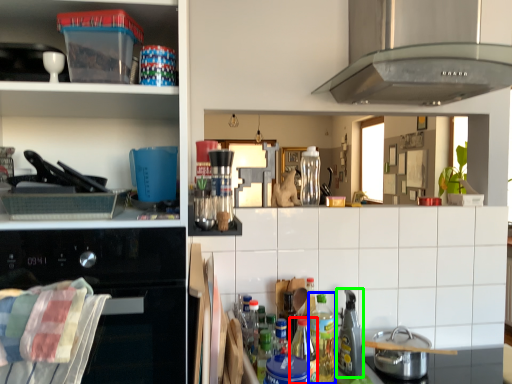
Question: Which is farther away from bottle (highlighted by a red box)? bottle (highlighted by a blue box) or appliance (highlighted by a green box)?

Choices:
 (A) bottle
 (B) appliance

Answer: (B)